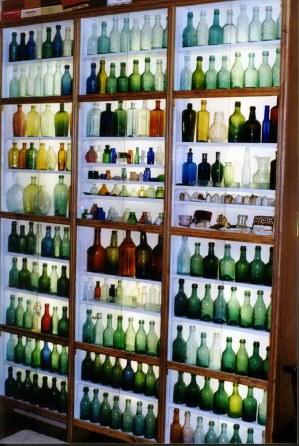
Identify the location of floor. This screenshot has height=446, width=299. (27, 439).